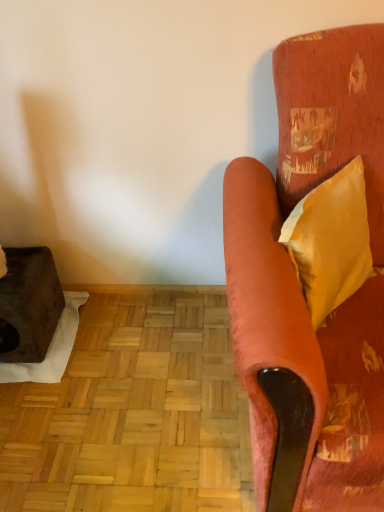
Question: Should I look upward or downward to see yellow satin pillow at right?

Choices:
 (A) down
 (B) up

Answer: (B)

Question: Is yellow satin pillow at right not close to velvet orange couch at right?

Choices:
 (A) no
 (B) yes

Answer: (A)

Question: Is yellow satin pillow at right facing towards velvet orange couch at right?

Choices:
 (A) yes
 (B) no

Answer: (A)

Question: From the image's perspective, is yellow satin pillow at right on velvet orange couch at right?

Choices:
 (A) yes
 (B) no

Answer: (A)

Question: Can you confirm if yellow satin pillow at right is bigger than velvet orange couch at right?

Choices:
 (A) yes
 (B) no

Answer: (B)

Question: From a real-world perspective, is yellow satin pillow at right positioned over velvet orange couch at right based on gravity?

Choices:
 (A) no
 (B) yes

Answer: (B)

Question: Considering the relative sizes of yellow satin pillow at right and velvet orange couch at right in the image provided, is yellow satin pillow at right taller than velvet orange couch at right?

Choices:
 (A) no
 (B) yes

Answer: (A)

Question: From the image's perspective, is velvet orange couch at right on yellow satin pillow at right?

Choices:
 (A) yes
 (B) no

Answer: (B)

Question: From a real-world perspective, is velvet orange couch at right positioned over yellow satin pillow at right based on gravity?

Choices:
 (A) yes
 (B) no

Answer: (B)

Question: From the image's perspective, would you say velvet orange couch at right is shown under yellow satin pillow at right?

Choices:
 (A) no
 (B) yes

Answer: (B)

Question: Is velvet orange couch at right outside yellow satin pillow at right?

Choices:
 (A) no
 (B) yes

Answer: (B)

Question: Is velvet orange couch at right bigger than yellow satin pillow at right?

Choices:
 (A) no
 (B) yes

Answer: (B)

Question: Is velvet orange couch at right positioned behind yellow satin pillow at right?

Choices:
 (A) yes
 (B) no

Answer: (B)

Question: Looking at their shapes, would you say velvet orange couch at right is wider or thinner than yellow satin pillow at right?

Choices:
 (A) thin
 (B) wide

Answer: (B)